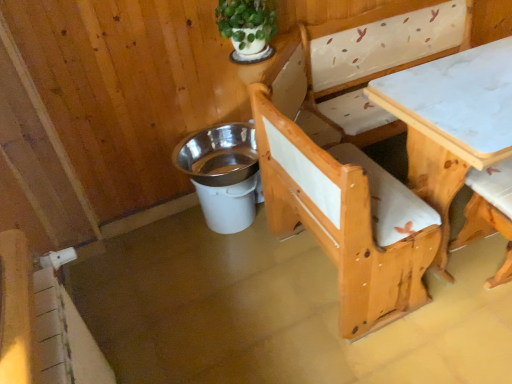
Where is `vacant space situated on the left part of white plastic bucket at lower center`? This screenshot has width=512, height=384. vacant space situated on the left part of white plastic bucket at lower center is located at coordinates (165, 242).